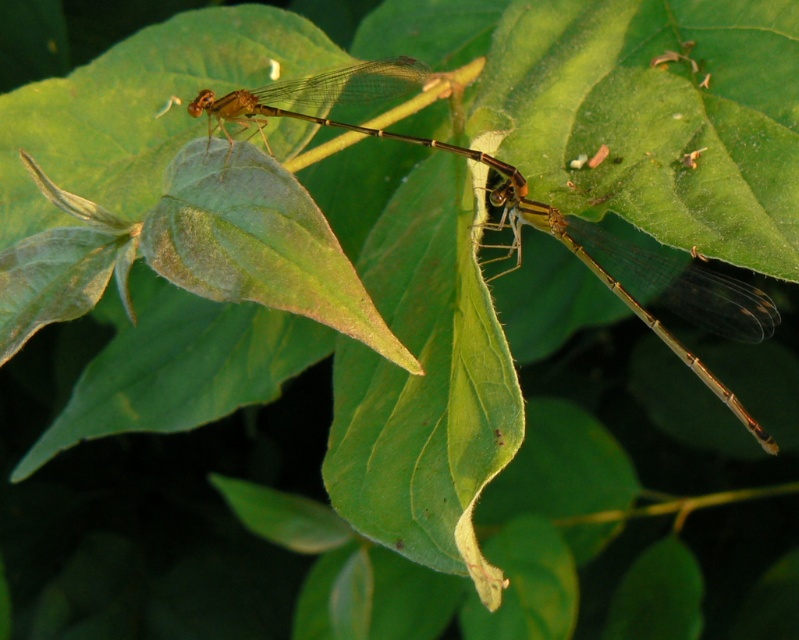
You are a photographer trying to focus on both dragonflies in the image. Which of the two points, point (547, 212) or point (320, 93), is closer to your camera lens?

Point (547, 212) is closer to the camera lens than point (320, 93).

You are a photographer trying to capture a dragonfly on a leaf. You see a translucent amber dragonfly at center at point (x=523, y=212). Can you confirm if this dragonfly is positioned exactly at the center of the leaf?

The translucent amber dragonfly at center is located at point (x=523, y=212), so it is positioned exactly at the center of the leaf.

You are a nature photographer trying to capture a photo of both dragonflies. Since they are positioned side by side, which dragonfly, the translucent amber dragonfly at center or the translucent amber dragonfly at upper center, is taller?

The translucent amber dragonfly at center is much taller than the translucent amber dragonfly at upper center.